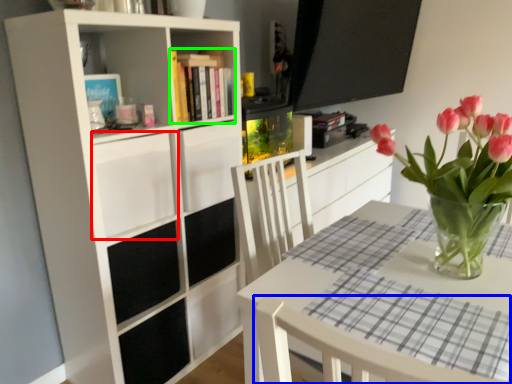
Question: Based on their relative distances, which object is nearer to drawer (highlighted by a red box)? Choose from chair (highlighted by a blue box) and book (highlighted by a green box).

Choices:
 (A) chair
 (B) book

Answer: (B)